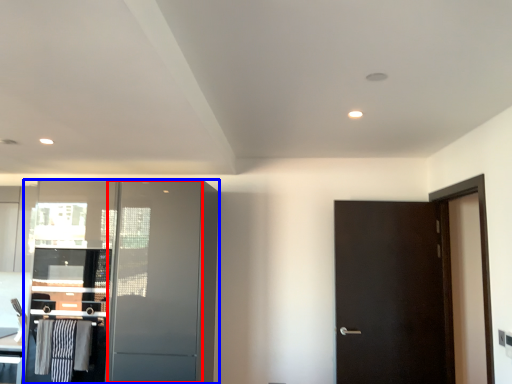
Question: Which point is further to the camera, screen door (highlighted by a red box) or cabinetry (highlighted by a blue box)?

Choices:
 (A) screen door
 (B) cabinetry

Answer: (B)